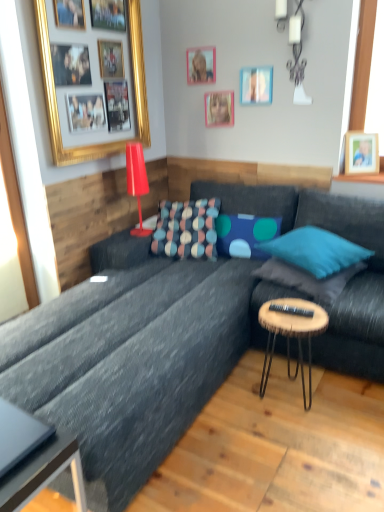
Question: Should I look upward or downward to see teal fabric pillow at center, arranged as the first pillow when viewed from the right?

Choices:
 (A) down
 (B) up

Answer: (A)

Question: Is white ceramic lamp at upper center, which is the second lamp in bottom-to-top order, oriented away from metallic gray coffee table at lower left?

Choices:
 (A) yes
 (B) no

Answer: (B)

Question: Is white ceramic lamp at upper center, the second lamp positioned from the left, not inside metallic gray coffee table at lower left?

Choices:
 (A) no
 (B) yes

Answer: (B)

Question: Is white ceramic lamp at upper center, the 1th lamp in the right-to-left sequence, further to camera compared to metallic gray coffee table at lower left?

Choices:
 (A) yes
 (B) no

Answer: (A)

Question: Is white ceramic lamp at upper center, which appears as the 1th lamp when viewed from the top, at the right side of metallic gray coffee table at lower left?

Choices:
 (A) no
 (B) yes

Answer: (B)

Question: Is white ceramic lamp at upper center, the 1th lamp in the right-to-left sequence, positioned in front of metallic gray coffee table at lower left?

Choices:
 (A) yes
 (B) no

Answer: (B)

Question: From a real-world perspective, is white ceramic lamp at upper center, the second lamp positioned from the left, physically below metallic gray coffee table at lower left?

Choices:
 (A) no
 (B) yes

Answer: (A)

Question: Could you tell me if textured fabric pillow at center, the 4th pillow from the right, is facing wooden photo frame at upper right, the 1th picture frame from the right?

Choices:
 (A) yes
 (B) no

Answer: (B)

Question: Is wooden photo frame at upper right, acting as the 5th picture frame starting from the left, located within textured fabric pillow at center, positioned as the 1th pillow in left-to-right order?

Choices:
 (A) yes
 (B) no

Answer: (B)

Question: Considering the relative sizes of textured fabric pillow at center, positioned as the 1th pillow in left-to-right order, and wooden photo frame at upper right, the 1th picture frame from the right, in the image provided, is textured fabric pillow at center, positioned as the 1th pillow in left-to-right order, wider than wooden photo frame at upper right, the 1th picture frame from the right,?

Choices:
 (A) yes
 (B) no

Answer: (A)

Question: Considering the relative positions of textured fabric pillow at center, positioned as the 1th pillow in left-to-right order, and wooden photo frame at upper right, acting as the 5th picture frame starting from the left, in the image provided, is textured fabric pillow at center, positioned as the 1th pillow in left-to-right order, to the right of wooden photo frame at upper right, acting as the 5th picture frame starting from the left, from the viewer's perspective?

Choices:
 (A) no
 (B) yes

Answer: (A)

Question: From a real-world perspective, is textured fabric pillow at center, positioned as the 1th pillow in left-to-right order, located beneath wooden photo frame at upper right, acting as the 5th picture frame starting from the left?

Choices:
 (A) no
 (B) yes

Answer: (B)

Question: Is textured fabric pillow at center, the 4th pillow from the right, facing away from wooden photo frame at upper right, acting as the 5th picture frame starting from the left?

Choices:
 (A) no
 (B) yes

Answer: (A)

Question: From the image's perspective, is textured fabric pillow at center, the 4th pillow from the right, on matte pink picture frame at upper center, acting as the third picture frame starting from the left?

Choices:
 (A) no
 (B) yes

Answer: (A)